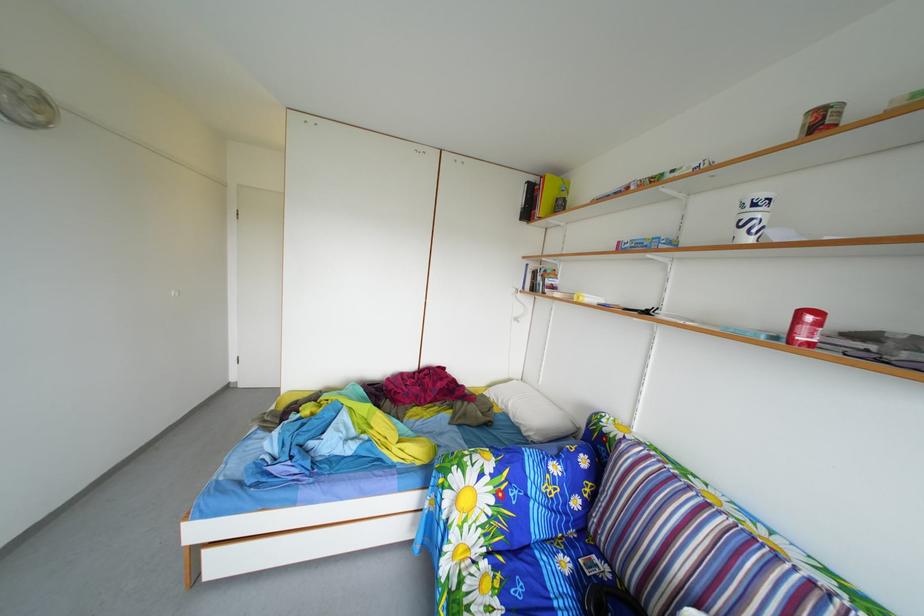
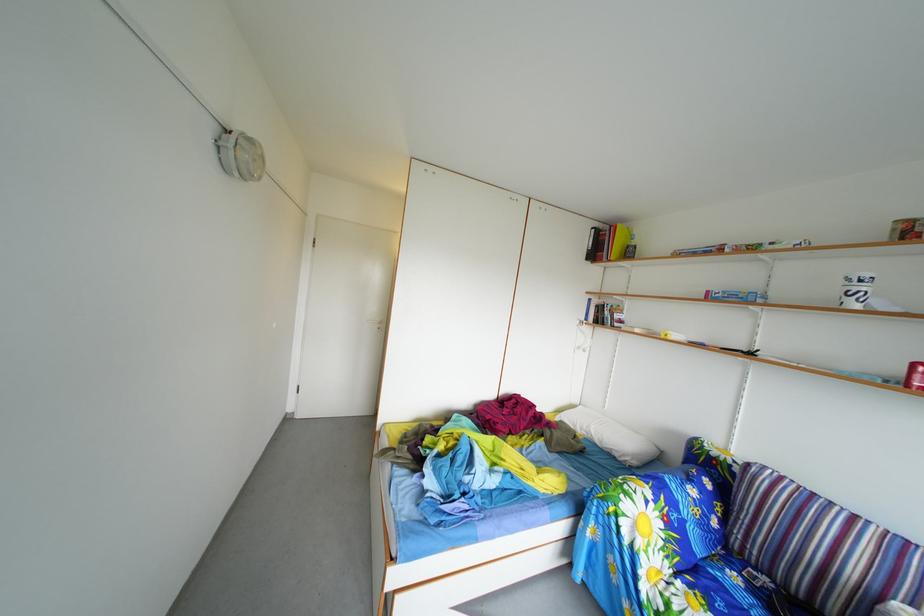
Question: Based on the continuous images, in which direction is the camera rotating? Reply with the corresponding letter.

Choices:
 (A) Left
 (B) Right
 (C) Up
 (D) Down

Answer: (B)